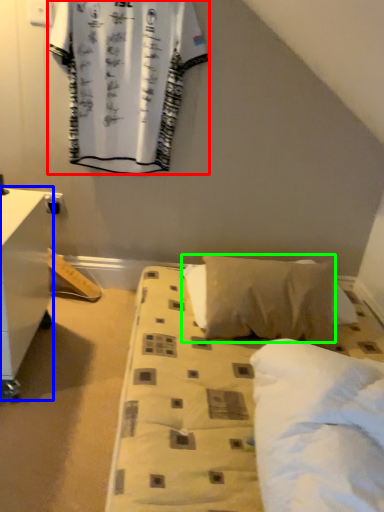
Question: Which object is the closest to the curtain (highlighted by a red box)? Choose among these: nightstand (highlighted by a blue box) or pillow (highlighted by a green box).

Choices:
 (A) nightstand
 (B) pillow

Answer: (A)